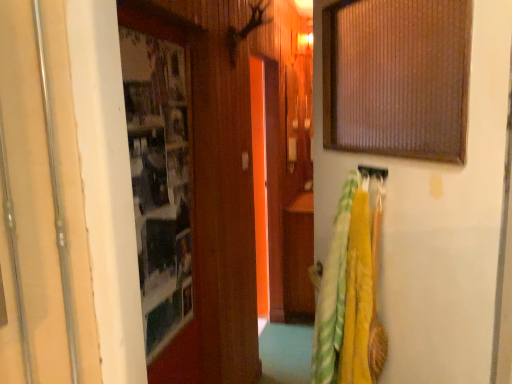
Question: Should I look upward or downward to see yellow fabric towel at right?

Choices:
 (A) up
 (B) down

Answer: (B)

Question: Is transparent glass door at center with metallic silver door at left?

Choices:
 (A) yes
 (B) no

Answer: (B)

Question: From the image's perspective, does transparent glass door at center appear lower than metallic silver door at left?

Choices:
 (A) yes
 (B) no

Answer: (A)

Question: Can you confirm if transparent glass door at center is taller than metallic silver door at left?

Choices:
 (A) yes
 (B) no

Answer: (A)

Question: Would you consider transparent glass door at center to be distant from metallic silver door at left?

Choices:
 (A) yes
 (B) no

Answer: (A)

Question: Is transparent glass door at center to the left of metallic silver door at left from the viewer's perspective?

Choices:
 (A) yes
 (B) no

Answer: (B)

Question: Is transparent glass door at center positioned beyond the bounds of metallic silver door at left?

Choices:
 (A) yes
 (B) no

Answer: (A)

Question: From the image's perspective, is yellow fabric towel at right located above metallic silver door at left?

Choices:
 (A) no
 (B) yes

Answer: (A)

Question: Can you confirm if yellow fabric towel at right is positioned to the right of metallic silver door at left?

Choices:
 (A) no
 (B) yes

Answer: (B)

Question: Is yellow fabric towel at right facing towards metallic silver door at left?

Choices:
 (A) yes
 (B) no

Answer: (A)

Question: Considering the relative positions of yellow fabric towel at right and metallic silver door at left in the image provided, is yellow fabric towel at right to the left of metallic silver door at left from the viewer's perspective?

Choices:
 (A) yes
 (B) no

Answer: (B)

Question: From the image's perspective, is yellow fabric towel at right below metallic silver door at left?

Choices:
 (A) yes
 (B) no

Answer: (A)

Question: Considering the relative sizes of yellow fabric towel at right and metallic silver door at left in the image provided, is yellow fabric towel at right thinner than metallic silver door at left?

Choices:
 (A) no
 (B) yes

Answer: (A)

Question: Considering the relative positions of yellow fabric towel at right and transparent glass door at center in the image provided, is yellow fabric towel at right to the right of transparent glass door at center from the viewer's perspective?

Choices:
 (A) yes
 (B) no

Answer: (A)